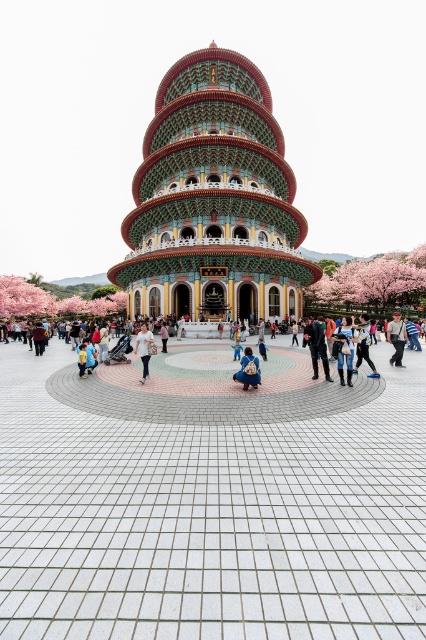
You are standing in the plaza in front of the pagoda and see a blue denim jacket at center and a yellow fabric bag at center. Which object is taller?

The blue denim jacket at center is taller than the yellow fabric bag at center.

You are standing in the plaza and see the white tiled plaza at center and the light brown leather jacket at lower right. Which object is located to the right side of the other?

The light brown leather jacket at lower right is located to the right of the white tiled plaza at center.